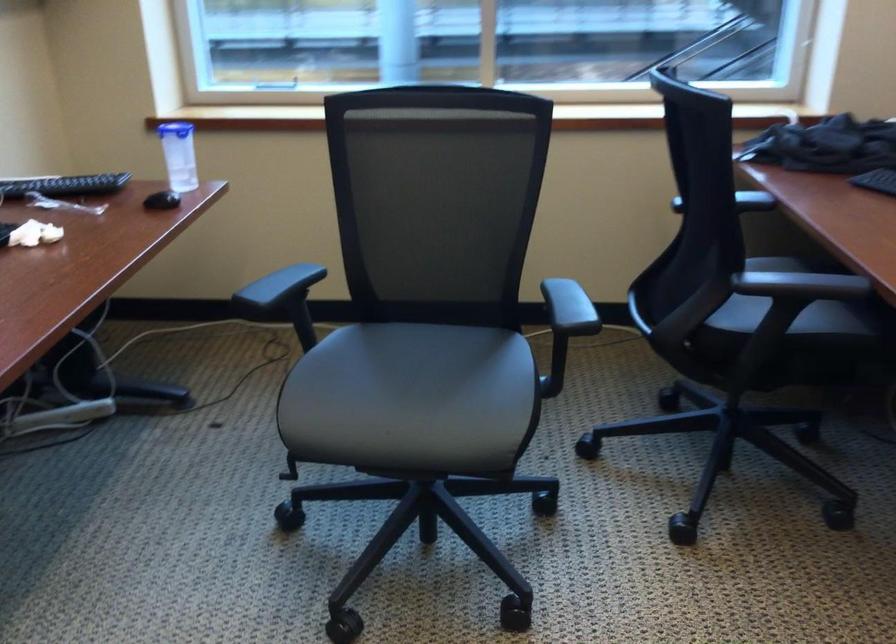
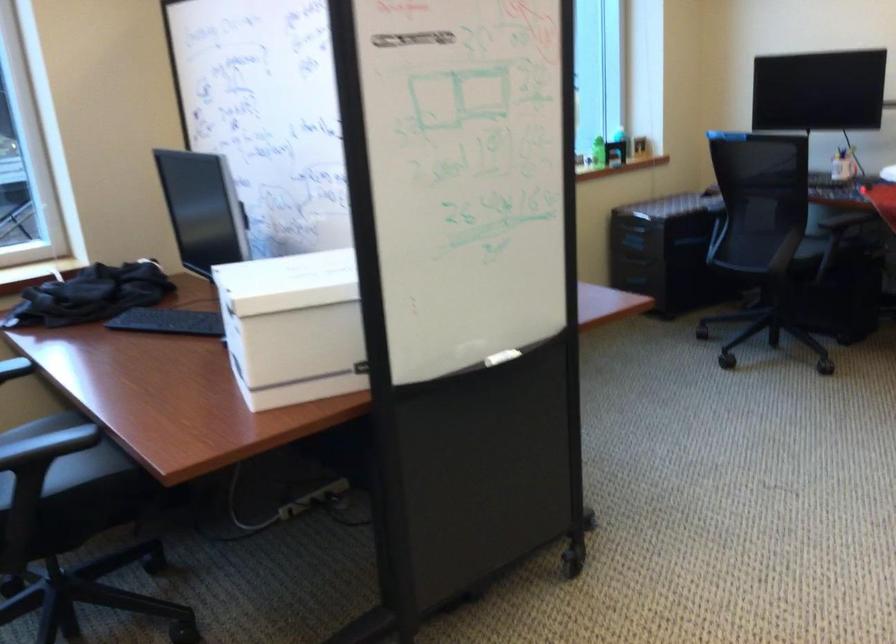
Where in the second image is the point corresponding to point (805, 283) from the first image?

(47, 446)